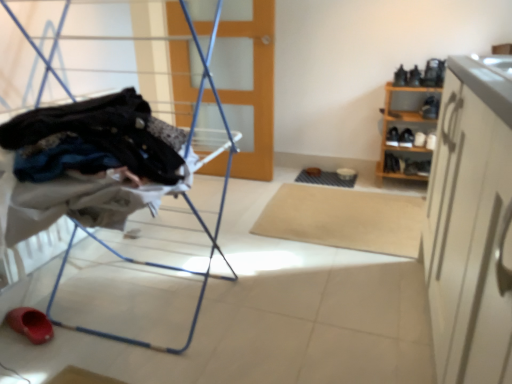
At what (x,y) coordinates should I click in order to perform the action: click on free area below beige carpet at center (from a real-world perspective). Please return your answer as a coordinate pair (x, y). Looking at the image, I should click on (348, 210).